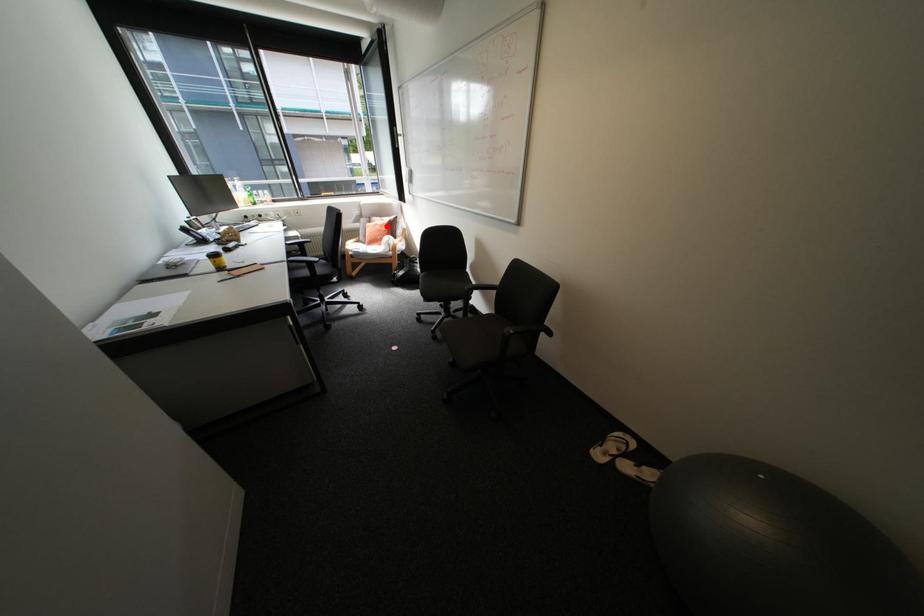
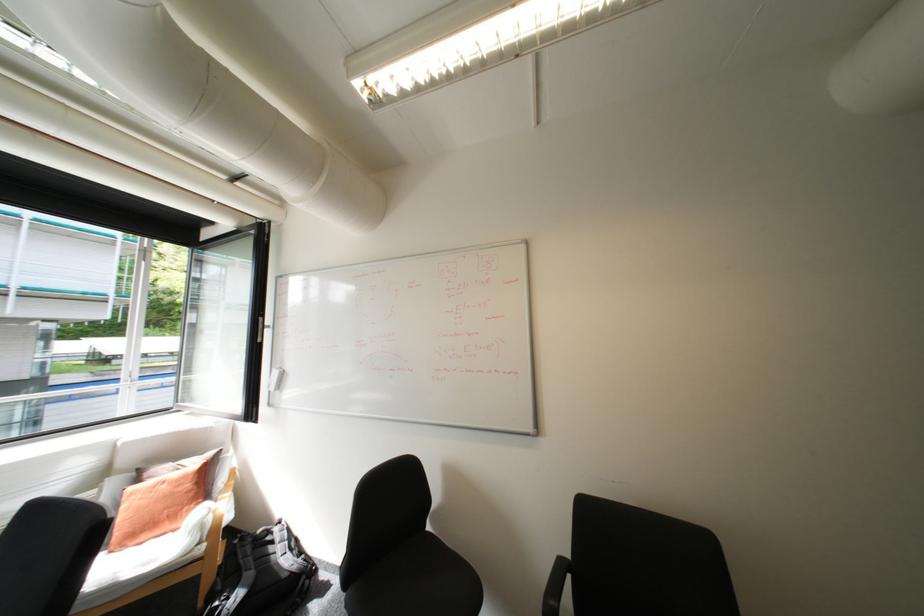
Question: I am providing you with two images of the same scene from different viewpoints. Given a red point in image1, look at the same physical point in image2. Is it:

Choices:
 (A) Closer to the viewpoint
 (B) Farther from the viewpoint

Answer: (B)